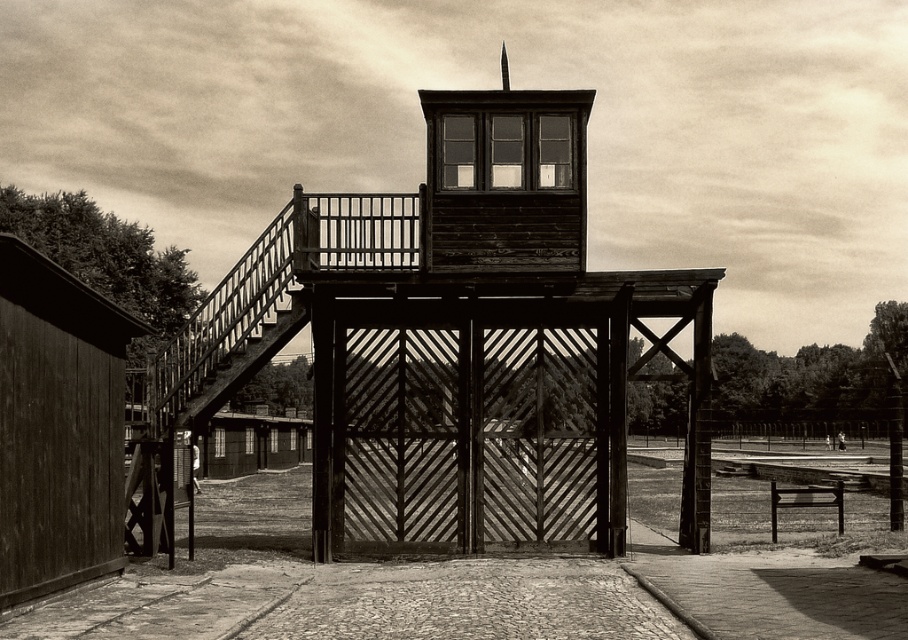
Question: Which point is closer to the camera taking this photo?

Choices:
 (A) (545, 148)
 (B) (382, 428)

Answer: (A)

Question: Can you confirm if wooden gate at center is thinner than wooden bell tower at center?

Choices:
 (A) no
 (B) yes

Answer: (A)

Question: Which object is closer to the camera taking this photo?

Choices:
 (A) wooden gate at center
 (B) wooden bell tower at center

Answer: (A)

Question: Is wooden gate at center in front of wooden bell tower at center?

Choices:
 (A) yes
 (B) no

Answer: (A)

Question: Does wooden gate at center appear over wooden bell tower at center?

Choices:
 (A) no
 (B) yes

Answer: (A)